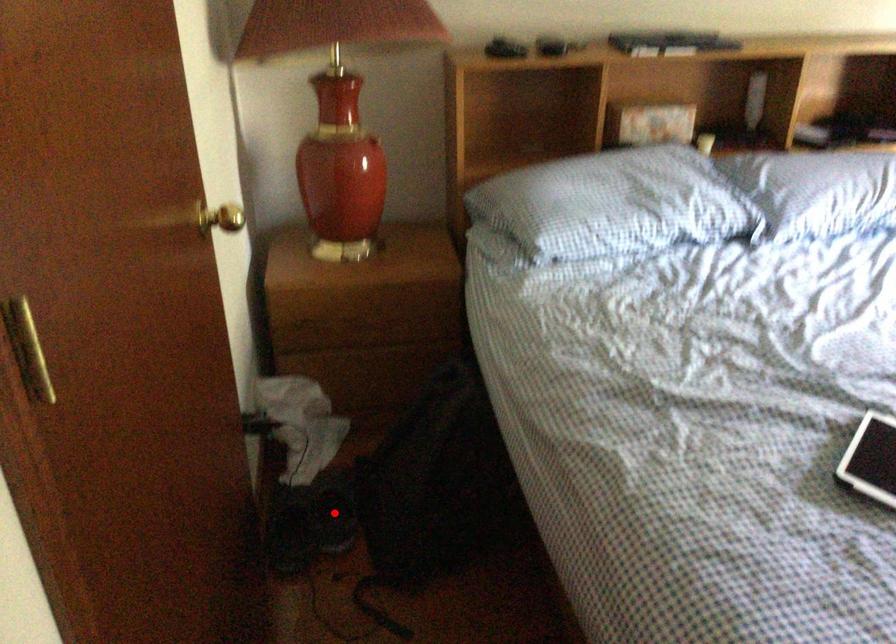
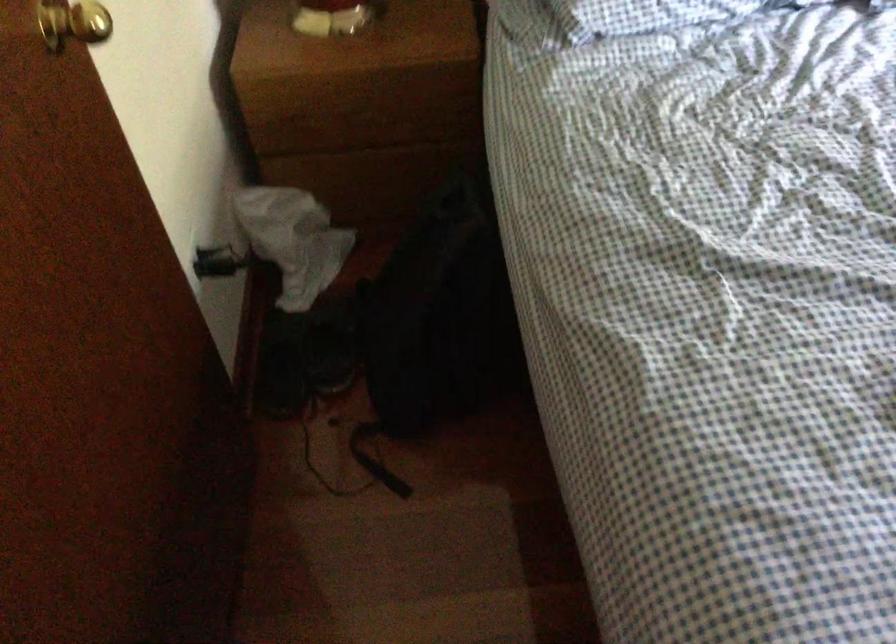
Where in the second image is the point corresponding to the highlighted location from the first image?

(332, 345)